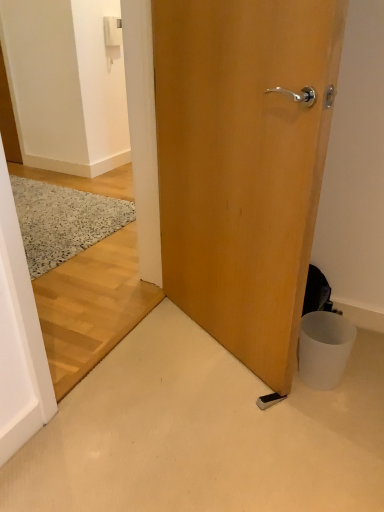
Question: Can you confirm if wooden door at center is smaller than white plastic light switch at upper center?

Choices:
 (A) yes
 (B) no

Answer: (B)

Question: Considering the relative sizes of wooden door at center and white plastic light switch at upper center in the image provided, is wooden door at center taller than white plastic light switch at upper center?

Choices:
 (A) yes
 (B) no

Answer: (A)

Question: Is wooden door at center touching white plastic light switch at upper center?

Choices:
 (A) no
 (B) yes

Answer: (A)

Question: From the image's perspective, is wooden door at center located beneath white plastic light switch at upper center?

Choices:
 (A) yes
 (B) no

Answer: (A)

Question: From a real-world perspective, is wooden door at center under white plastic light switch at upper center?

Choices:
 (A) yes
 (B) no

Answer: (A)

Question: Is wooden door at center to the right of white plastic light switch at upper center from the viewer's perspective?

Choices:
 (A) yes
 (B) no

Answer: (A)

Question: Is speckled wool doormat at left inside wooden door at center?

Choices:
 (A) no
 (B) yes

Answer: (A)

Question: From the image's perspective, is wooden door at center above speckled wool doormat at left?

Choices:
 (A) yes
 (B) no

Answer: (B)

Question: Is wooden door at center shorter than speckled wool doormat at left?

Choices:
 (A) yes
 (B) no

Answer: (B)

Question: Are wooden door at center and speckled wool doormat at left located far from each other?

Choices:
 (A) no
 (B) yes

Answer: (B)

Question: From a real-world perspective, is wooden door at center under speckled wool doormat at left?

Choices:
 (A) no
 (B) yes

Answer: (A)

Question: Is wooden door at center aimed at speckled wool doormat at left?

Choices:
 (A) yes
 (B) no

Answer: (B)

Question: From a real-world perspective, does white matte trash bin at lower right sit lower than speckled wool doormat at left?

Choices:
 (A) no
 (B) yes

Answer: (A)